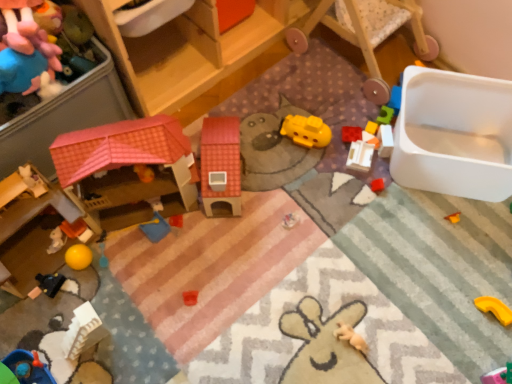
At what (x,y) coordinates should I click in order to perform the action: click on vacant area that lies between matte plastic dollhouse at center-left, the fourth toy viewed from the left, and white plastic building at center-right, positioned as the 4th toy in right-to-left order. Please return your answer as a coordinate pair (x, y). Looking at the image, I should click on (290, 177).